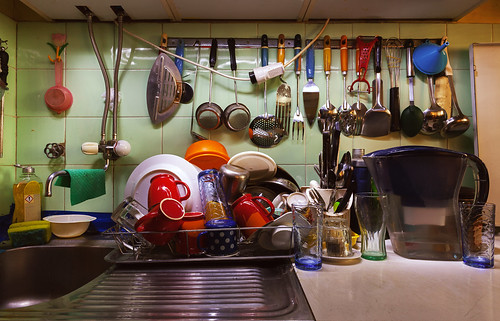
This screenshot has width=500, height=321. I want to click on white polka dots on cup, so click(x=231, y=247), click(x=235, y=239), click(x=231, y=231), click(x=227, y=239), click(x=222, y=234), click(x=222, y=248), click(x=218, y=242), click(x=210, y=234), click(x=210, y=248).